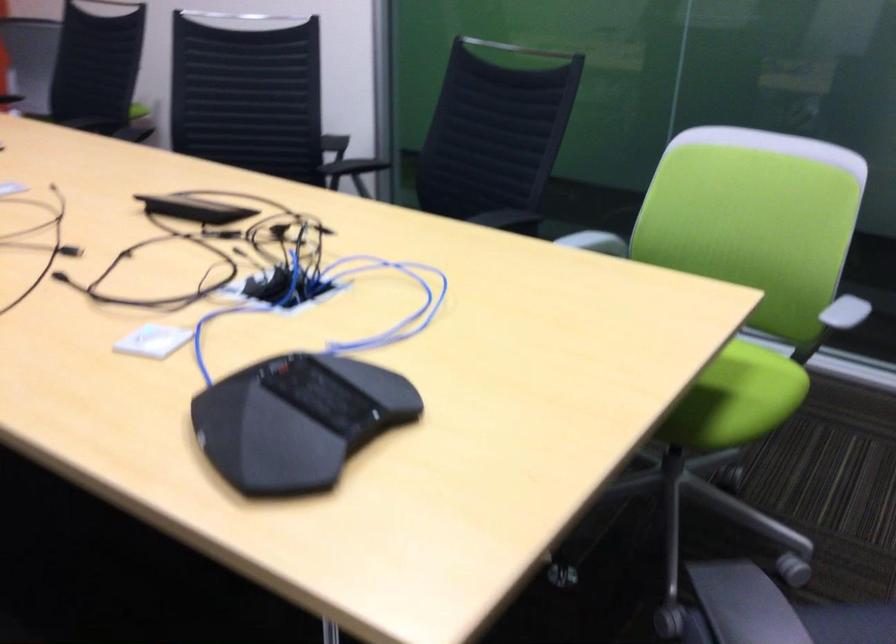
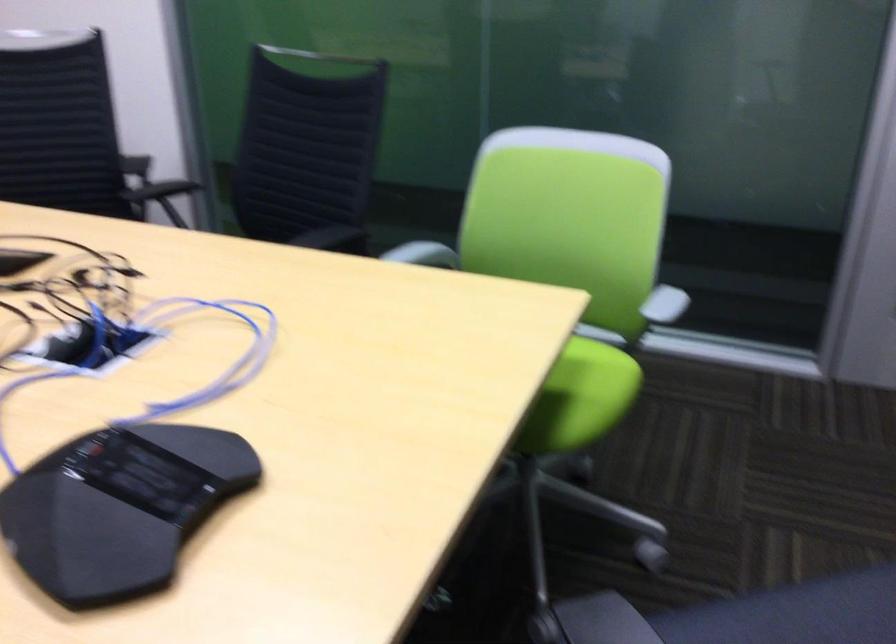
Locate, in the second image, the point that corresponds to point (289, 426) in the first image.

(119, 507)